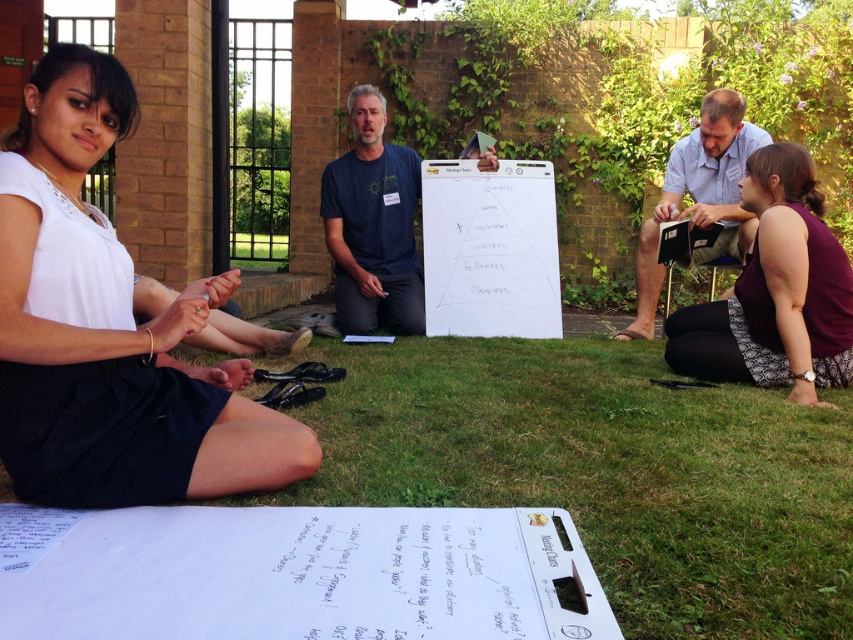
Question: Which point appears closest to the camera in this image?

Choices:
 (A) (717, 253)
 (B) (672, 253)
 (C) (404, 244)

Answer: (B)

Question: Can you confirm if white fabric skirt at lower left is thinner than purple fabric shirt at lower right?

Choices:
 (A) yes
 (B) no

Answer: (B)

Question: Does purple fabric shirt at lower right appear on the left side of dark blue t-shirt at center?

Choices:
 (A) no
 (B) yes

Answer: (A)

Question: Based on their relative distances, which object is farther from the dark blue t-shirt at center?

Choices:
 (A) matte black clipboard at lower right
 (B) white fabric skirt at lower left
 (C) white paper clipboard at center
 (D) blue denim shirt at upper right

Answer: (B)

Question: Can you confirm if blue denim shirt at upper right is positioned to the right of matte black clipboard at lower right?

Choices:
 (A) yes
 (B) no

Answer: (B)

Question: Which point is closer to the camera?

Choices:
 (A) dark blue t-shirt at center
 (B) white fabric skirt at lower left

Answer: (B)